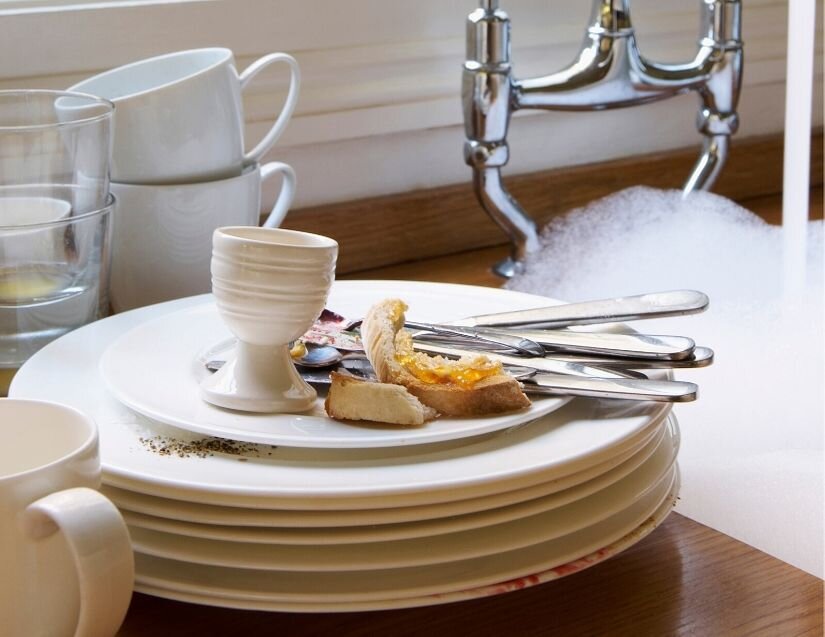
This screenshot has width=825, height=637. I want to click on utensil, so click(583, 385), click(515, 371), click(514, 340), click(574, 343), click(602, 360), click(604, 306), click(604, 371), click(703, 352).